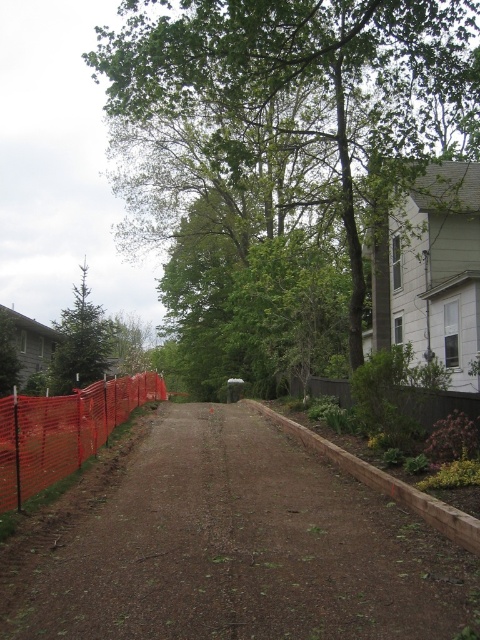
You are standing at the starting point of the dirt pathway in the residential area. You notice two points marked on the path. One is at coordinate point [237,173] and the other is at coordinate point [72,332]. Which point is closer to you as you stand at the beginning of the path?

The point at coordinate point [237,173] is closer to you than the point at coordinate point [72,332] because it is nearer to the camera position where you are standing.

You are a delivery person trying to navigate through the residential area. You see the brown dirt track at center and the brown wood fence at lower right. Which object is positioned to the left of the other?

The brown dirt track at center is to the left of the brown wood fence at lower right.

You are standing at the camera position and want to water the green leafy tree at center. If your watering can holds enough water for a 10 meter trip, can you reach the tree without needing to refill?

The green leafy tree at center and camera are 11.67 meters apart, which is beyond the 10 meter capacity of the watering can. You will need to refill before reaching the tree.